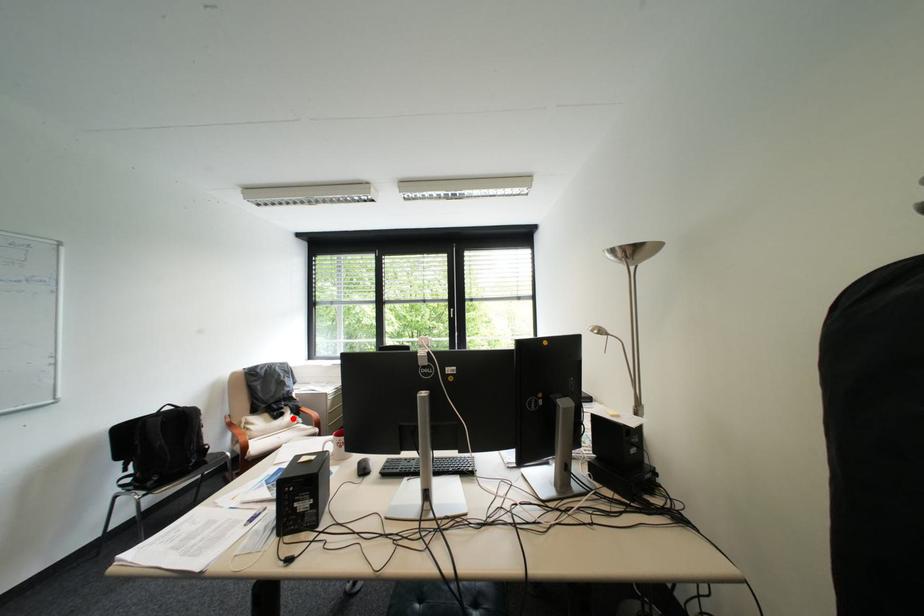
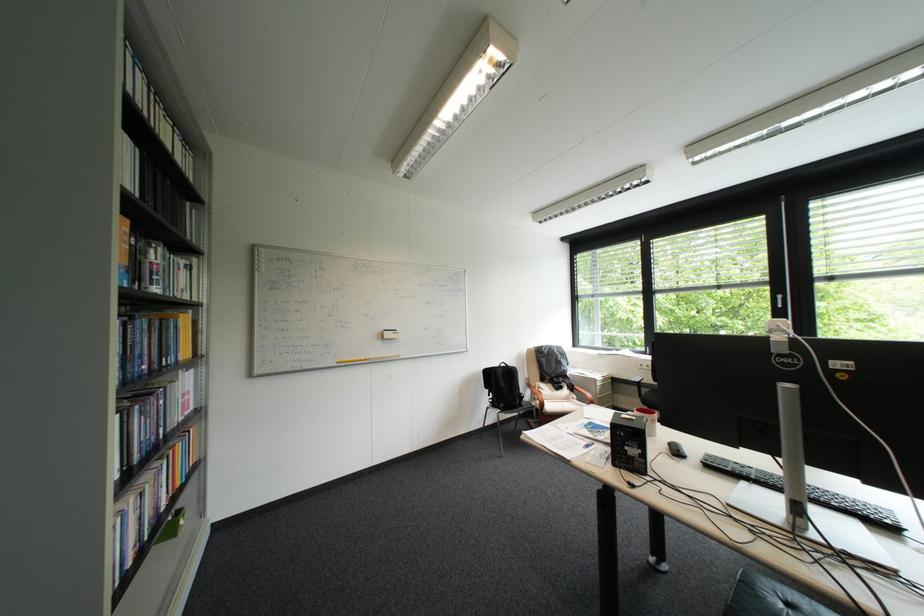
Question: I am providing you with two images of the same scene from different viewpoints. In image1, a red point is highlighted. Considering the same 3D point in image2, which of the following is correct?

Choices:
 (A) It is closer
 (B) It is farther

Answer: (B)